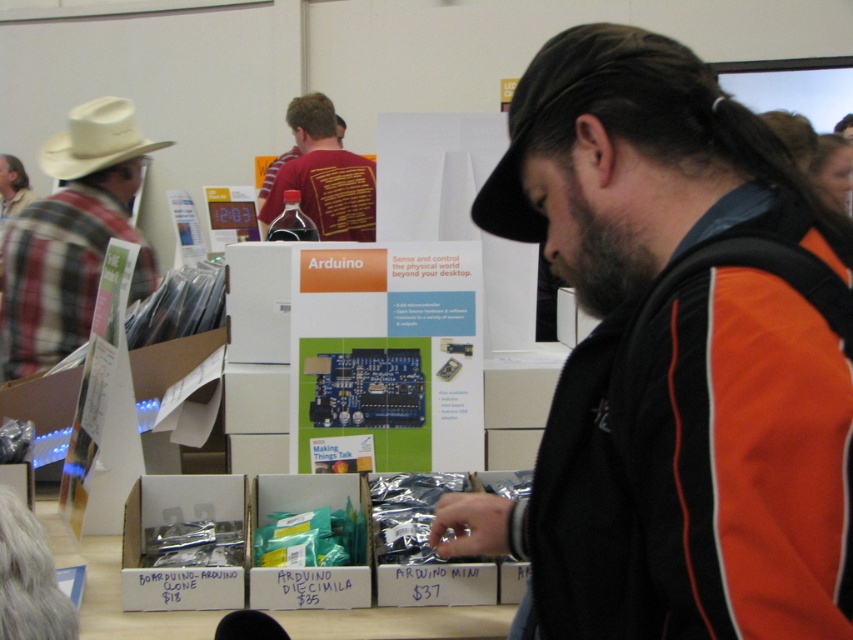
Consider the image. You are an attendee at the tech event and want to pick up the metallic silver arduino clone at lower left. However, you can only reach items that are above the teal plastic box at center. Can you reach it?

The metallic silver arduino clone at lower left is below the teal plastic box at center, so it is not above it. Therefore, you cannot reach it.

You are an event organizer at the tech exhibition. You need to place both the white leather cowboy hat at left and the white felt cowboy hat at left on a shelf. Which hat should you place first to ensure they fit side by side without overlapping?

The white felt cowboy hat at left should be placed first since it is smaller in size compared to the white leather cowboy hat at left, allowing both to fit side by side without overlapping.